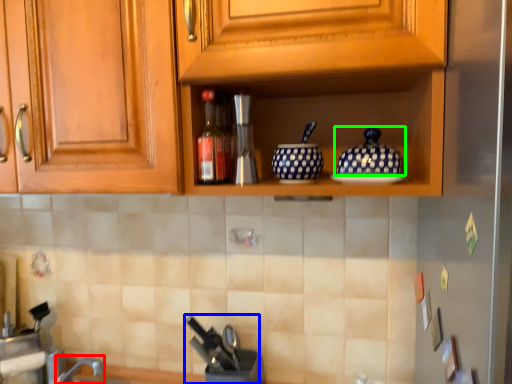
Question: Considering the real-world distances, which object is closest to faucet (highlighted by a red box)? appliance (highlighted by a blue box) or pottery (highlighted by a green box).

Choices:
 (A) appliance
 (B) pottery

Answer: (A)